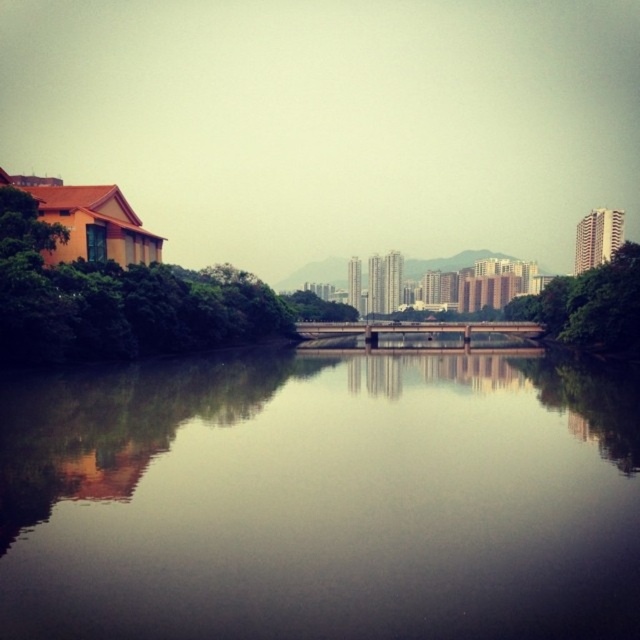
Question: Considering the relative positions of smooth reflective water at center and green leafy tree at right in the image provided, where is smooth reflective water at center located with respect to green leafy tree at right?

Choices:
 (A) above
 (B) below

Answer: (B)

Question: Considering the relative positions of green leafy tree at left and green leafy tree at right in the image provided, where is green leafy tree at left located with respect to green leafy tree at right?

Choices:
 (A) left
 (B) right

Answer: (A)

Question: Can you confirm if smooth reflective water at center is positioned to the right of green leafy tree at center?

Choices:
 (A) yes
 (B) no

Answer: (A)

Question: Which point is farther to the camera?

Choices:
 (A) (584, 346)
 (B) (378, 440)

Answer: (A)

Question: Considering the real-world distances, which object is farthest from the green leafy tree at left?

Choices:
 (A) green leafy tree at right
 (B) smooth reflective water at center
 (C) green leafy tree at center

Answer: (A)

Question: Which of the following is the farthest from the observer?

Choices:
 (A) (625, 257)
 (B) (140, 266)

Answer: (A)